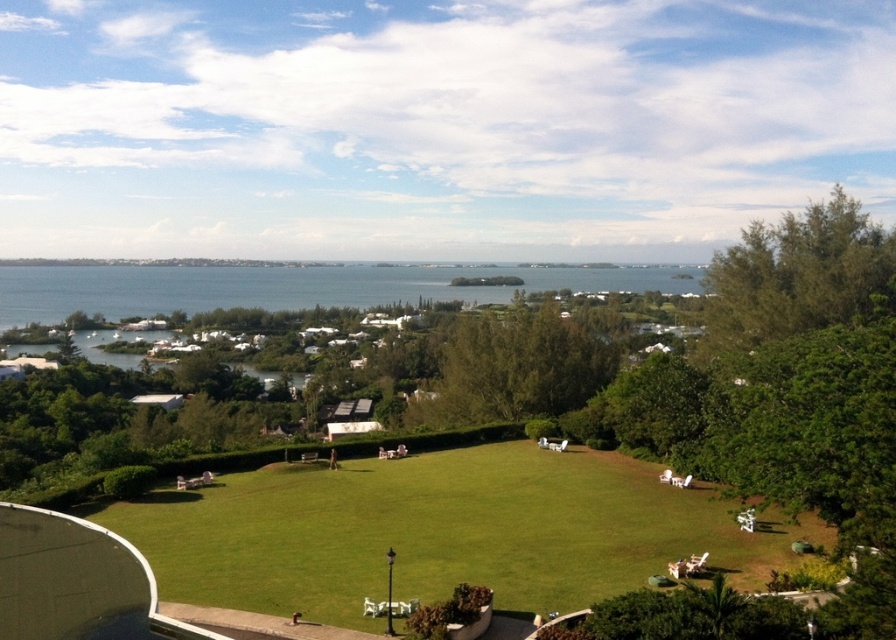
From the picture: Does green leafy tree at upper right have a greater height compared to green leafy tree at center?

Indeed, green leafy tree at upper right has a greater height compared to green leafy tree at center.

Is green leafy tree at upper right wider than green leafy tree at center?

Yes, green leafy tree at upper right is wider than green leafy tree at center.

Image resolution: width=896 pixels, height=640 pixels. I want to click on green leafy tree at upper right, so click(x=794, y=275).

At what (x,y) coordinates should I click in order to perform the action: click on green leafy tree at upper right. Please return your answer as a coordinate pair (x, y). Looking at the image, I should click on (794, 275).

Between point (471, 518) and point (863, 230), which one is positioned in front?

Point (471, 518) is in front.

The image size is (896, 640). What do you see at coordinates (441, 532) in the screenshot?
I see `green grass lawn at center` at bounding box center [441, 532].

The height and width of the screenshot is (640, 896). Describe the element at coordinates (441, 532) in the screenshot. I see `green grass lawn at center` at that location.

The width and height of the screenshot is (896, 640). Find the location of `green grass lawn at center`. green grass lawn at center is located at coordinates (441, 532).

Based on the photo, between blue water at center and green leafy tree at upper right, which one is positioned higher?

green leafy tree at upper right is higher up.

Is point (205, 289) in front of point (804, 323)?

No, it is not.

This screenshot has width=896, height=640. Identify the location of blue water at center. (289, 288).